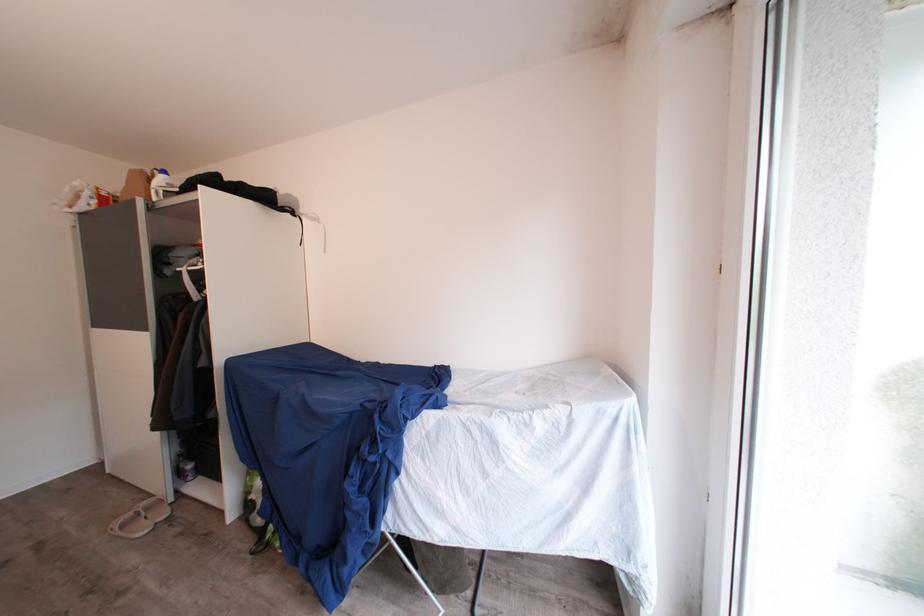
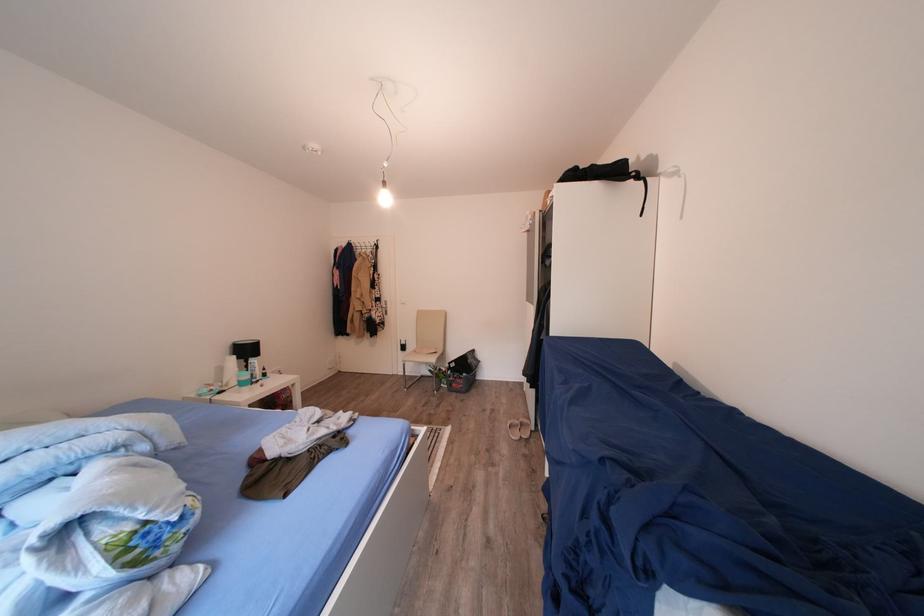
Question: The camera is either moving clockwise (left) or counter-clockwise (right) around the object. The first image is from the beginning of the video and the second image is from the end. Is the camera moving left or right when shooting the video?

Choices:
 (A) Left
 (B) Right

Answer: (B)